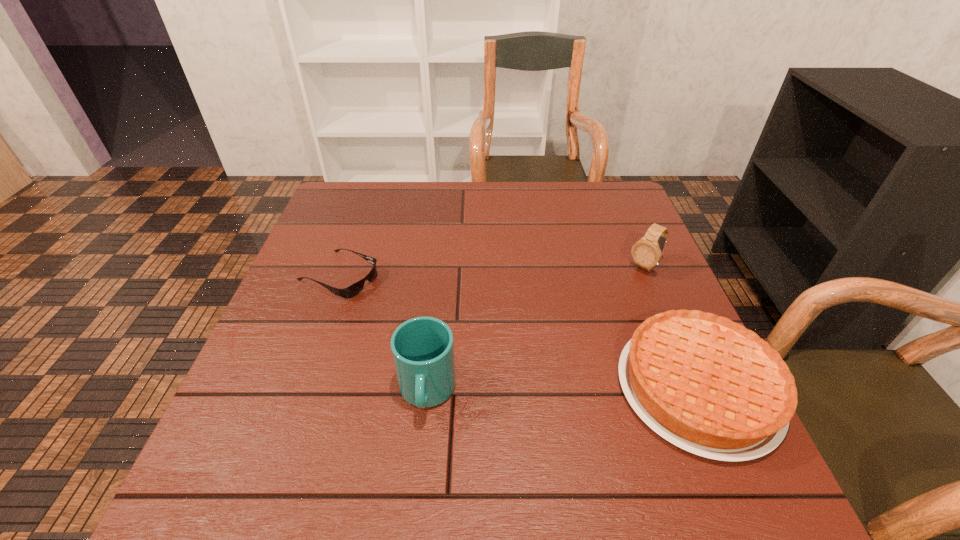
At what (x,y) coordinates should I click in order to perform the action: click on vacant space at the left edge of the desktop. Please return your answer as a coordinate pair (x, y). This screenshot has width=960, height=540. Looking at the image, I should click on (347, 275).

In the image, there is a desktop. Where is `vacant area at the far left corner`? Image resolution: width=960 pixels, height=540 pixels. vacant area at the far left corner is located at coordinates (342, 185).

Locate an element on the screen. The width and height of the screenshot is (960, 540). free location at the near left corner is located at coordinates (264, 409).

Where is `free space between the pie and the second object from left to right`? The image size is (960, 540). free space between the pie and the second object from left to right is located at coordinates (563, 390).

Where is `empty location between the watch and the third object from right to left`? empty location between the watch and the third object from right to left is located at coordinates (536, 330).

Identify the location of vacant region between the third object from right to left and the pie. (563, 390).

What are the coordinates of `free spot between the second object from left to right and the third tallest object` in the screenshot? It's located at (563, 390).

You are a GUI agent. You are given a task and a screenshot of the screen. Output one action in this format:
    pyautogui.click(x=<x>, y=<y>)
    Task: Click on the vacant region between the leftmost object and the watch
    The width and height of the screenshot is (960, 540).
    Given the screenshot: What is the action you would take?
    pyautogui.click(x=492, y=271)

Find the location of a particular element. The image size is (960, 540). free space between the leftmost object and the watch is located at coordinates (492, 271).

This screenshot has width=960, height=540. I want to click on empty space between the cup and the watch, so click(x=536, y=330).